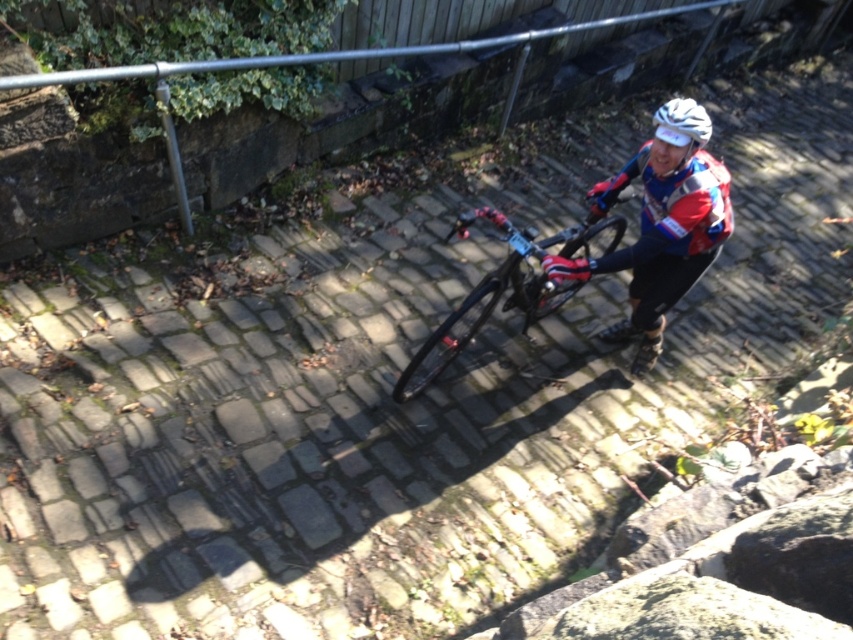
You are a photographer trying to capture the rider in focus. Since the red and white jersey at center and the shiny black frame at center are both in the scene, which one should you focus on first to ensure the rider is sharp?

The red and white jersey at center is closer to the viewer than the shiny black frame at center, so you should focus on the red and white jersey at center first to ensure the rider is sharp.